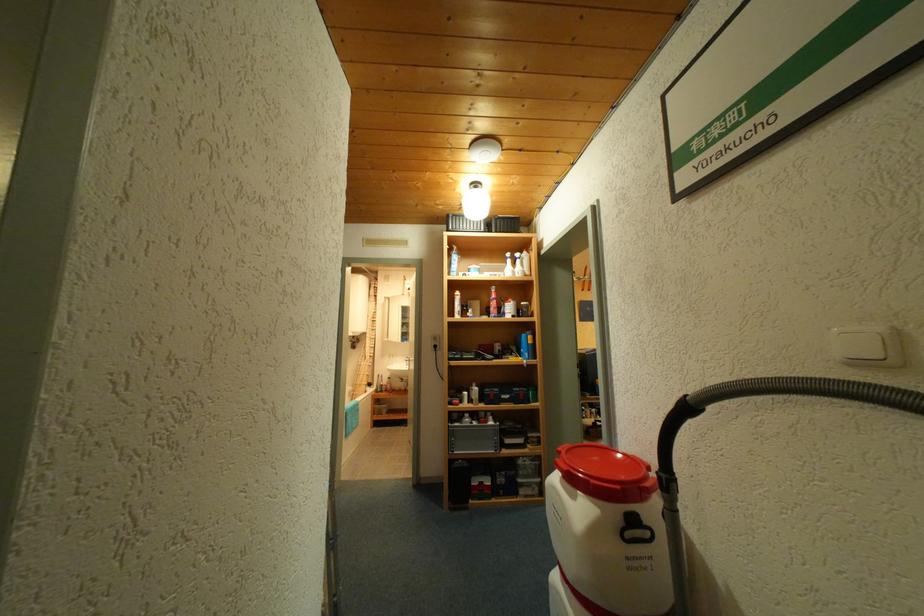
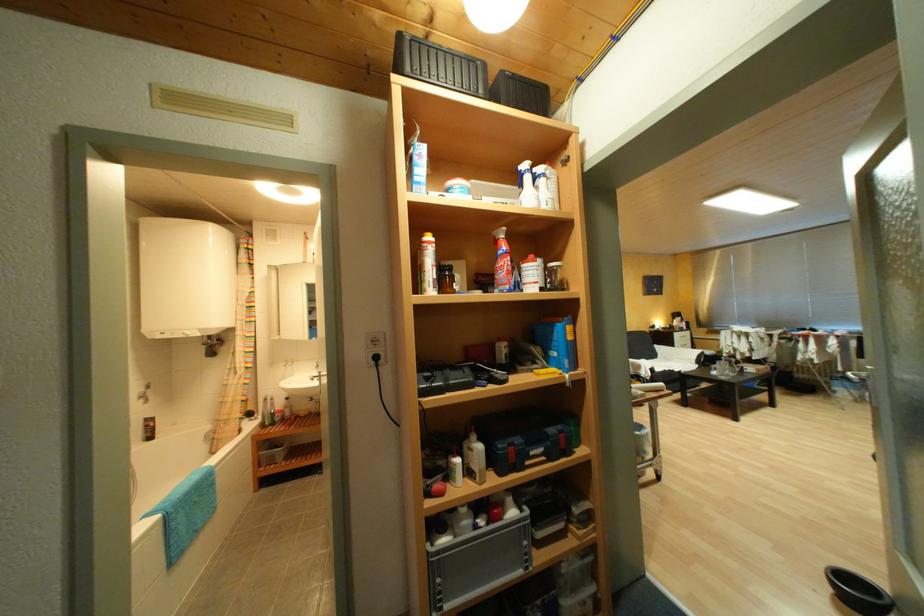
Find the pixel in the second image that matches [362,339] in the first image.

(220, 338)